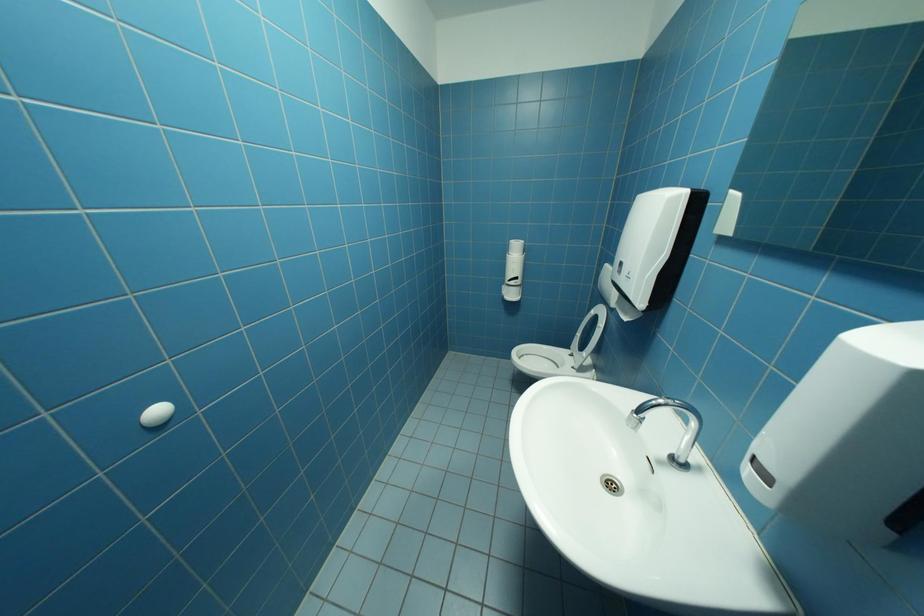
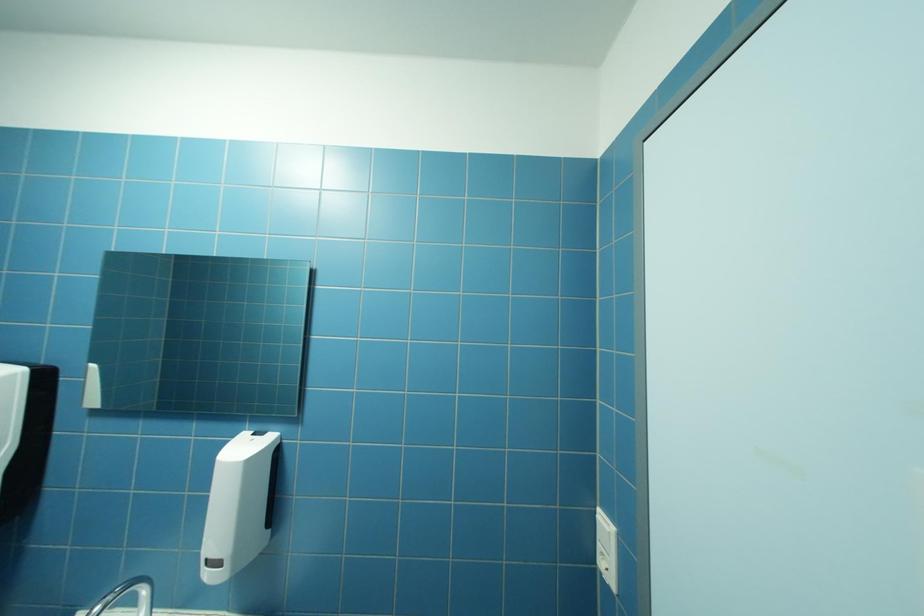
Question: How did the camera likely rotate?

Choices:
 (A) Left
 (B) Right
 (C) Up
 (D) Down

Answer: (B)